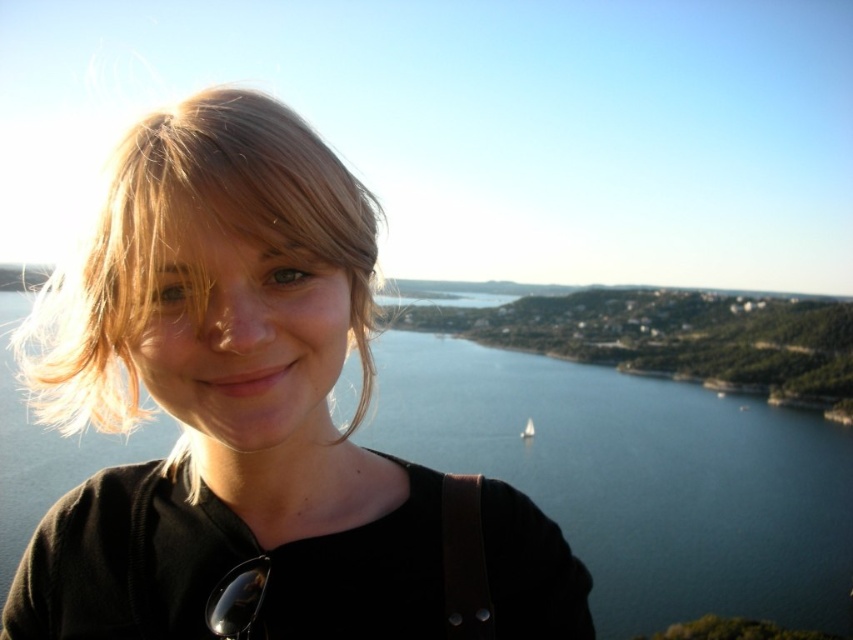
You are a photographer trying to adjust the lighting for a portrait. The subject has blonde hair at left. Where should you place the main light to ensure the hair is well illuminated?

The main light should be positioned near the point where the blonde hair at left is located, which is at coordinates approximately 0.370 on the x and 0.200 on the y axis, to effectively illuminate the hair.

You are a photographer adjusting the camera focus. The subject has a point marked at coordinates point (170, 236). Where does this point correspond to on the subject?

The point (170, 236) corresponds to the blonde hair at left.